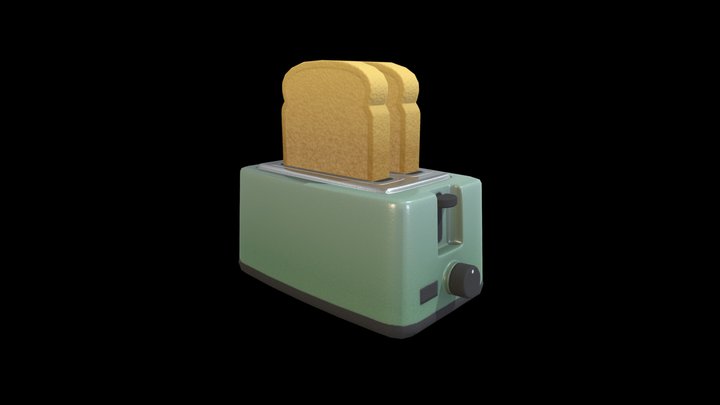
Find the location of a particular element. the left side of toaster is located at coordinates (336, 233).